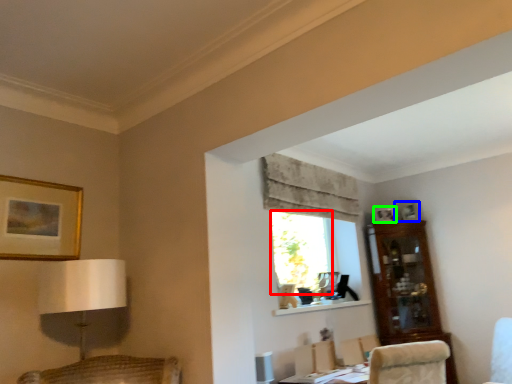
Question: Which is nearer to the window (highlighted by a red box)? picture frame (highlighted by a blue box) or picture frame (highlighted by a green box).

Choices:
 (A) picture frame
 (B) picture frame

Answer: (B)